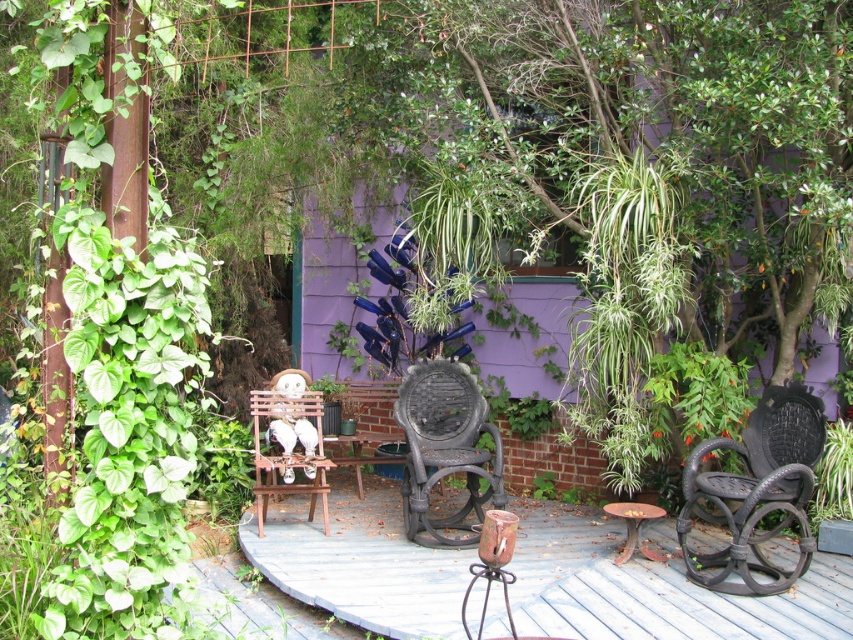
Question: Considering the relative positions of black woven chair at right and black wicker chair at center in the image provided, where is black woven chair at right located with respect to black wicker chair at center?

Choices:
 (A) right
 (B) left

Answer: (A)

Question: Can you confirm if rustic wood table at center is positioned below black wicker chair at center?

Choices:
 (A) no
 (B) yes

Answer: (B)

Question: Which point appears closest to the camera in this image?

Choices:
 (A) (428, 600)
 (B) (474, 396)
 (C) (810, 433)
 (D) (277, 400)

Answer: (A)

Question: Among these objects, which one is farthest from the camera?

Choices:
 (A) rustic wood table at center
 (B) woodenchair at center

Answer: (B)

Question: Which object is closer to the camera taking this photo?

Choices:
 (A) woodenchair at center
 (B) rustic wood table at center
 (C) black woven chair at right

Answer: (B)

Question: Is rustic wood table at center smaller than woodenchair at center?

Choices:
 (A) yes
 (B) no

Answer: (B)